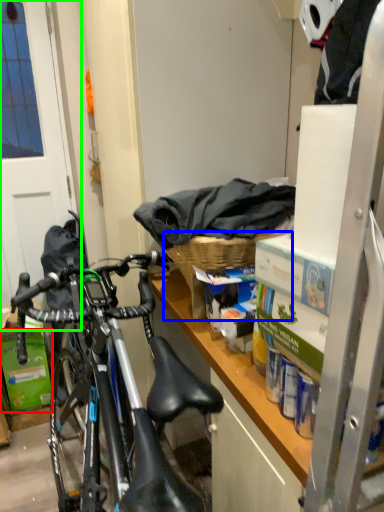
Question: Based on their relative distances, which object is nearer to box (highlighted by a red box)? Choose from picnic basket (highlighted by a blue box) and screen door (highlighted by a green box).

Choices:
 (A) picnic basket
 (B) screen door

Answer: (B)